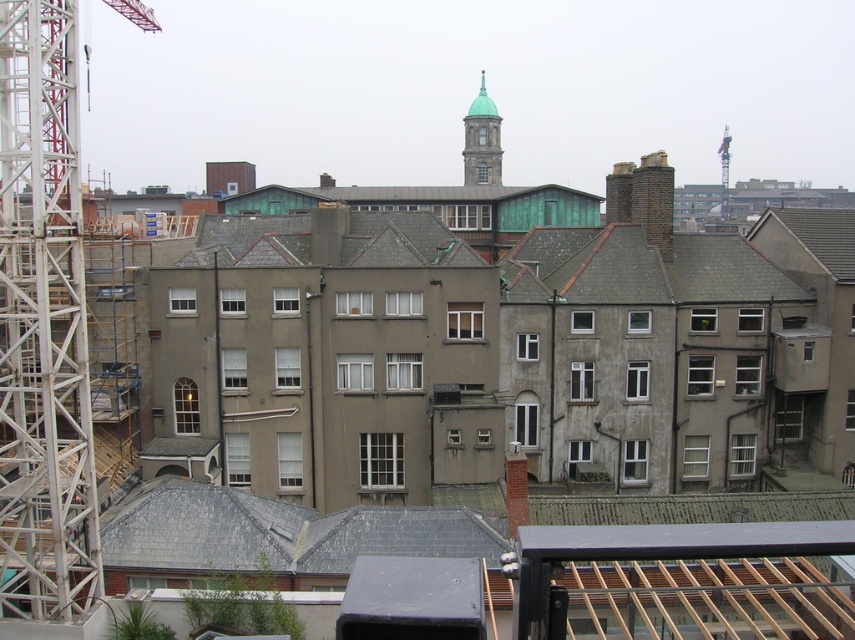
Is the position of white metal crane at left more distant than that of green copper bell tower at upper center?

No, white metal crane at left is in front of green copper bell tower at upper center.

Does white metal crane at left have a lesser height compared to green copper bell tower at upper center?

Incorrect, white metal crane at left's height does not fall short of green copper bell tower at upper center's.

Where is `white metal crane at left`? The image size is (855, 640). white metal crane at left is located at coordinates (43, 324).